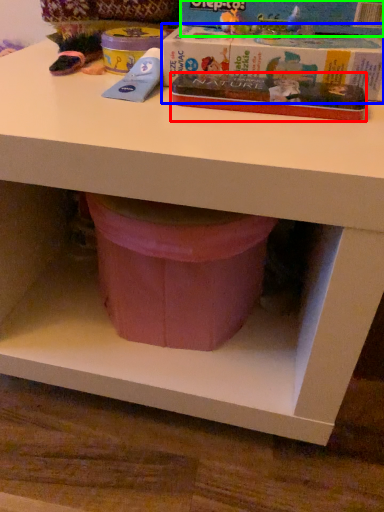
Question: Which is nearer to the paperback book (highlighted by a red box)? paperback book (highlighted by a blue box) or paperback book (highlighted by a green box).

Choices:
 (A) paperback book
 (B) paperback book

Answer: (A)